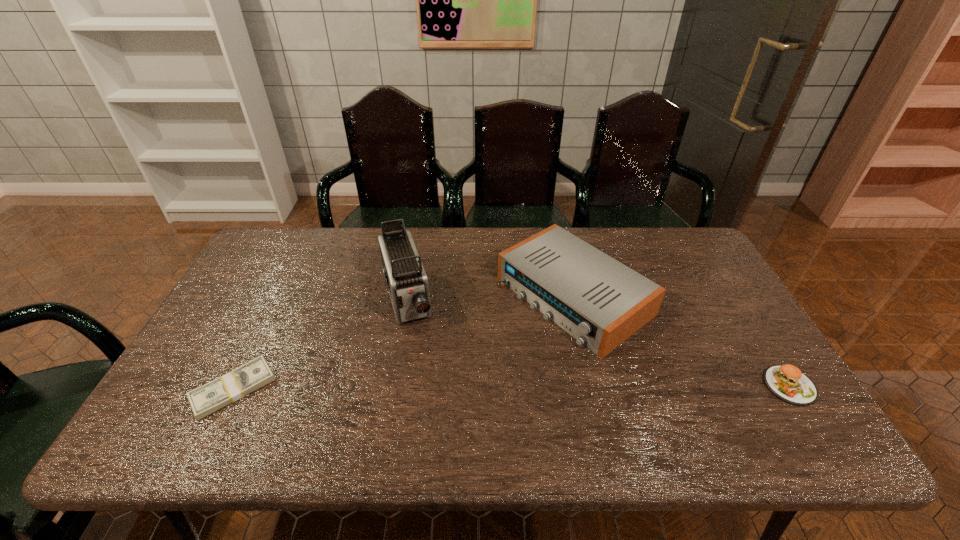
At what (x,y) coordinates should I click in order to perform the action: click on vacant spot on the desktop that is between the dollar and the rightmost object and is positioned on the front panel of the third shortest object. Please return your answer as a coordinate pair (x, y). Image resolution: width=960 pixels, height=540 pixels. Looking at the image, I should click on (435, 388).

The height and width of the screenshot is (540, 960). In order to click on free space on the desktop that is between the shortest object and the rightmost object and is positioned at the lens of the tallest object in this screenshot , I will do `click(435, 388)`.